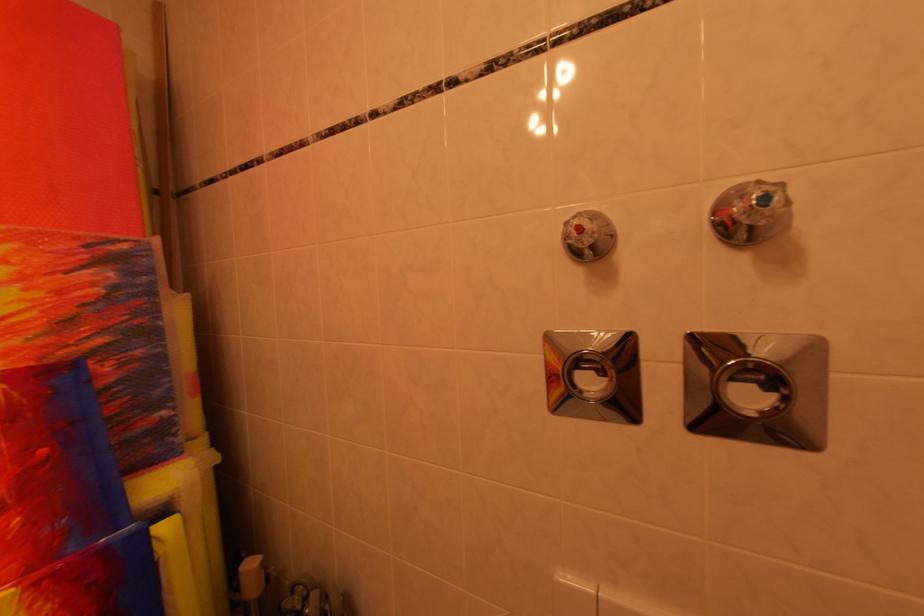
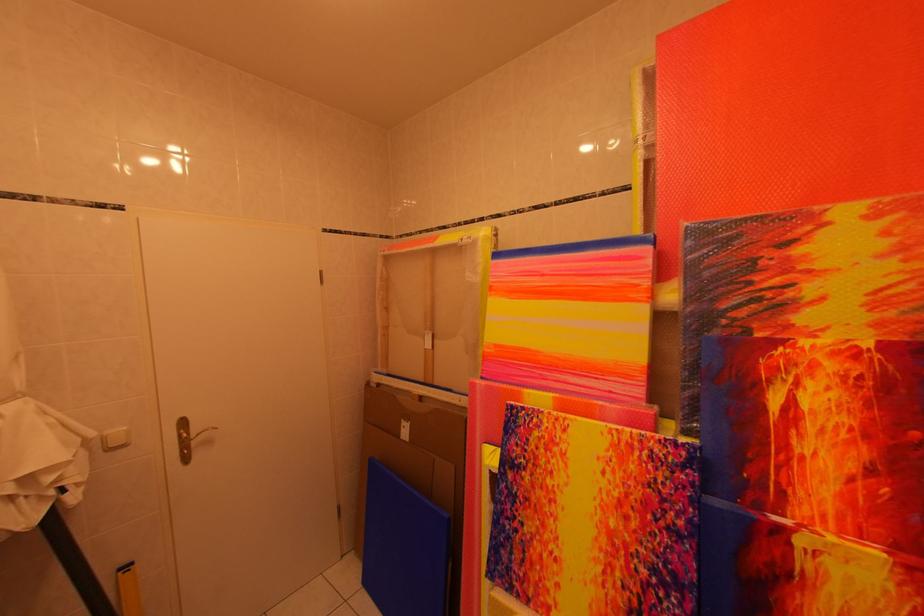
Question: The camera is either moving clockwise (left) or counter-clockwise (right) around the object. The first image is from the beginning of the video and the second image is from the end. Is the camera moving left or right when shooting the video?

Choices:
 (A) Left
 (B) Right

Answer: (B)